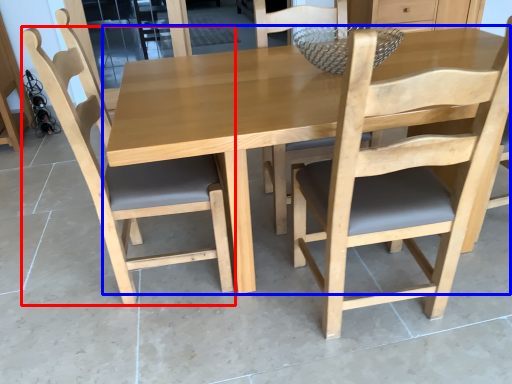
Question: Which object appears closest to the camera in this image, chair (highlighted by a red box) or kitchen & dining room table (highlighted by a blue box)?

Choices:
 (A) chair
 (B) kitchen & dining room table

Answer: (B)